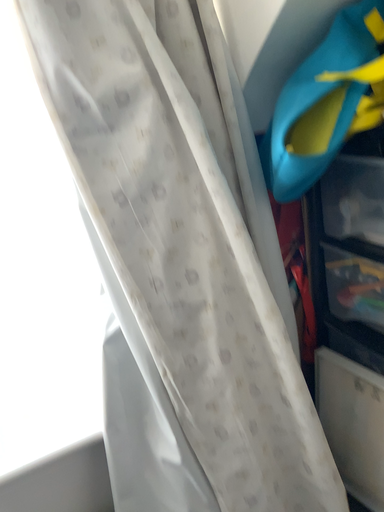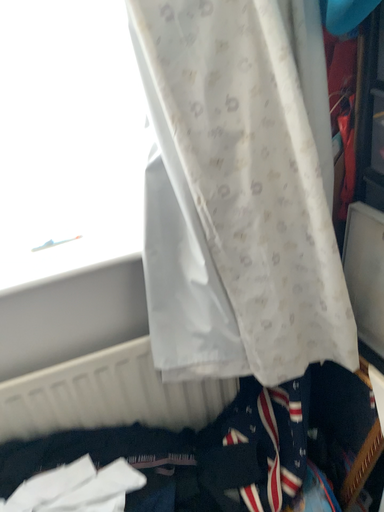
Question: Which way did the camera rotate in the video?

Choices:
 (A) rotated left
 (B) rotated right

Answer: (A)